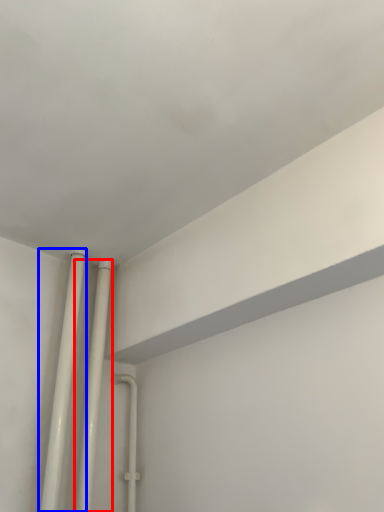
Question: Among these objects, which one is farthest to the camera, pipe (highlighted by a red box) or pipe (highlighted by a blue box)?

Choices:
 (A) pipe
 (B) pipe

Answer: (A)